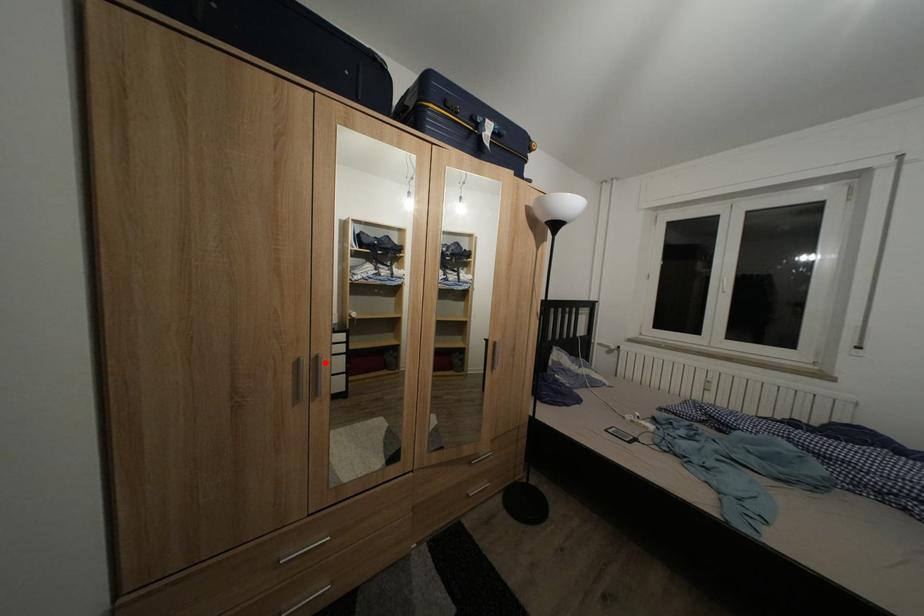
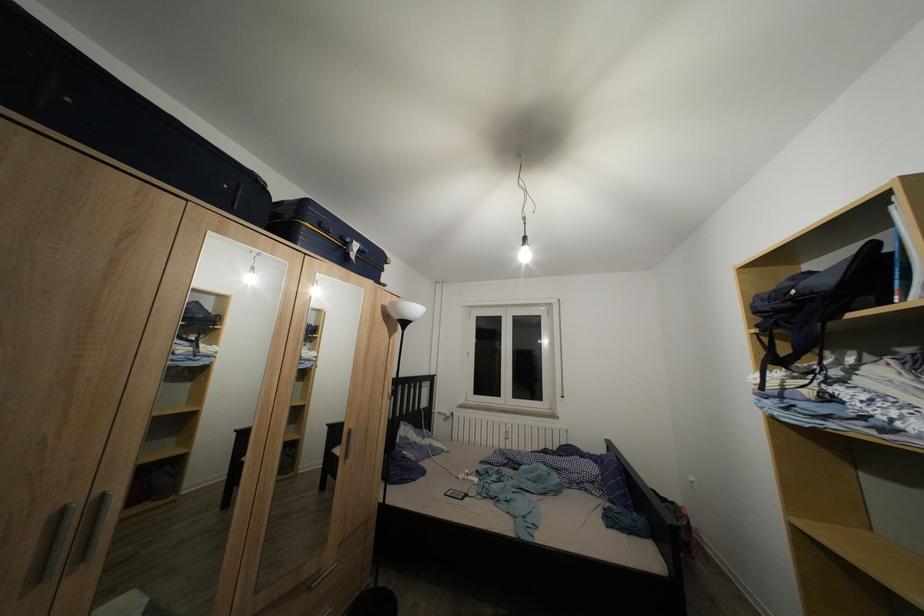
Question: I am providing you with two images of the same scene from different viewpoints. Given a red point in image1, look at the same physical point in image2. Is it:

Choices:
 (A) Closer to the viewpoint
 (B) Farther from the viewpoint

Answer: (B)